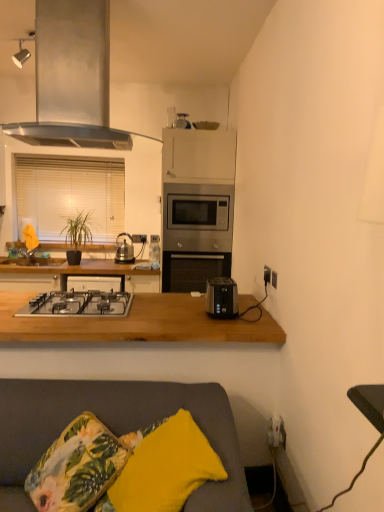
Question: Is wooden at lower center in front of or behind gray fabric couch at lower center in the image?

Choices:
 (A) behind
 (B) front

Answer: (A)

Question: Looking at their shapes, would you say wooden at lower center is wider or thinner than gray fabric couch at lower center?

Choices:
 (A) wide
 (B) thin

Answer: (B)

Question: Based on their relative distances, which object is nearer to the stainless steel microwave at center?

Choices:
 (A) yellow fabric pillow at lower center
 (B) shiny metallic kettle at center, which appears as the second appliance when viewed from the front
 (C) white plastic electrical outlet at center, placed as the second electric outlet when sorted from bottom to top
 (D) stainless steel range hood at upper left
 (E) floral fabric cushion at lower left

Answer: (C)

Question: Estimate the real-world distances between objects in this image. Which object is farther from the black plastic socket at right, placed as the 2th electric outlet when sorted from top to bottom?

Choices:
 (A) yellow fabric pillow at lower center
 (B) satin silver toaster at upper center, which ranks as the 1th appliance in right-to-left order
 (C) white blinds at left
 (D) gray fabric couch at lower center
 (E) stainless steel gas stove at center

Answer: (C)